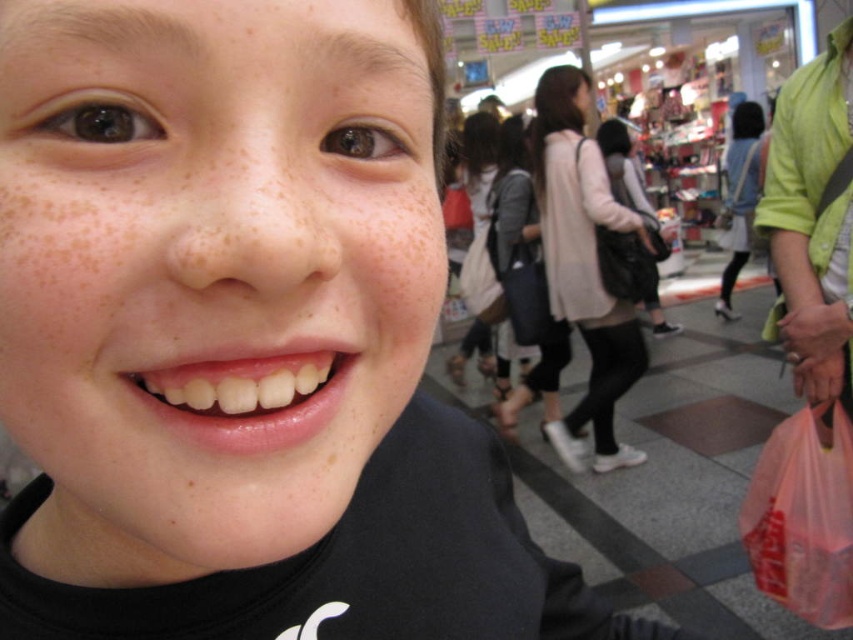
Does light pink fabric bag at center have a smaller size compared to pink plastic bag at lower right?

Incorrect, light pink fabric bag at center is not smaller in size than pink plastic bag at lower right.

Does light pink fabric bag at center have a lesser height compared to pink plastic bag at lower right?

No, light pink fabric bag at center is not shorter than pink plastic bag at lower right.

Is point (575, 268) positioned in front of point (836, 458)?

That is False.

Image resolution: width=853 pixels, height=640 pixels. What are the coordinates of `light pink fabric bag at center` in the screenshot? It's located at (583, 264).